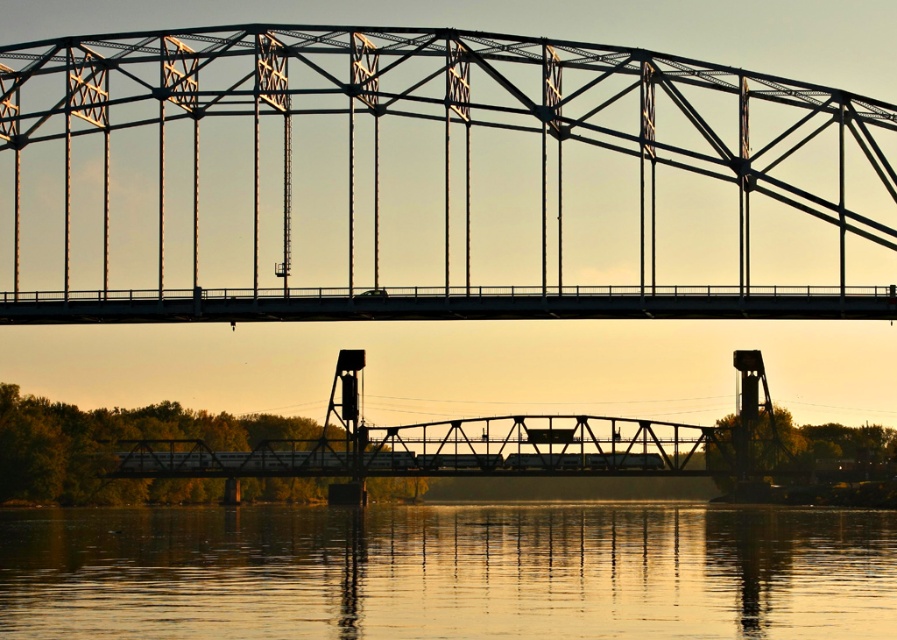
Question: Among these points, which one is nearest to the camera?

Choices:
 (A) (57, 51)
 (B) (803, 520)

Answer: (A)

Question: Is black steel bridge at center smaller than smooth gold water at lower center?

Choices:
 (A) no
 (B) yes

Answer: (A)

Question: Which point is farther to the camera?

Choices:
 (A) smooth gold water at lower center
 (B) black steel bridge at center

Answer: (A)

Question: Which object appears closest to the camera in this image?

Choices:
 (A) black steel bridge at center
 (B) smooth gold water at lower center

Answer: (A)

Question: Is black steel bridge at center closer to camera compared to smooth gold water at lower center?

Choices:
 (A) yes
 (B) no

Answer: (A)

Question: Can you confirm if black steel bridge at center is bigger than smooth gold water at lower center?

Choices:
 (A) yes
 (B) no

Answer: (A)